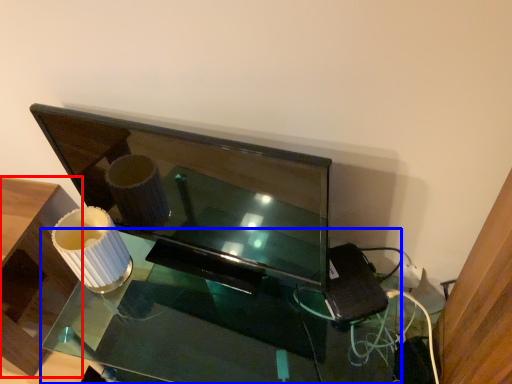
Question: Which object appears farthest to the camera in this image, furniture (highlighted by a red box) or table (highlighted by a blue box)?

Choices:
 (A) furniture
 (B) table

Answer: (A)